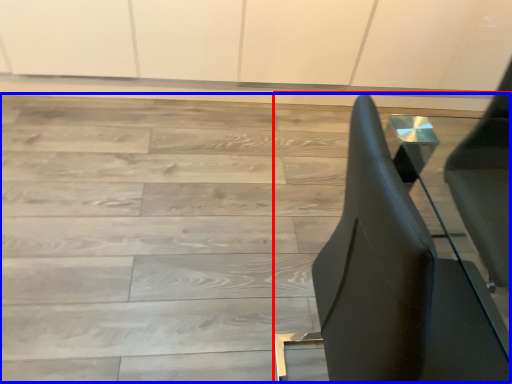
Question: Which object appears closest to the camera in this image, furniture (highlighted by a red box) or stairwell (highlighted by a blue box)?

Choices:
 (A) furniture
 (B) stairwell

Answer: (A)